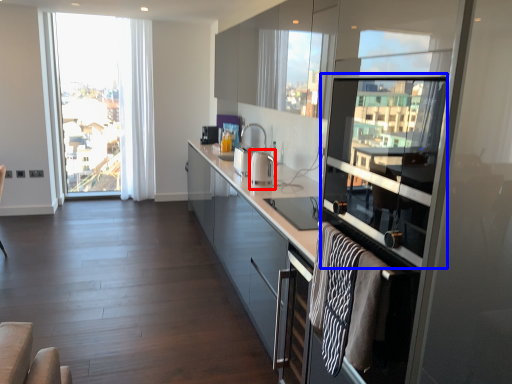
Question: Which of the following is the farthest to the observer, appliance (highlighted by a red box) or window screen (highlighted by a blue box)?

Choices:
 (A) appliance
 (B) window screen

Answer: (A)